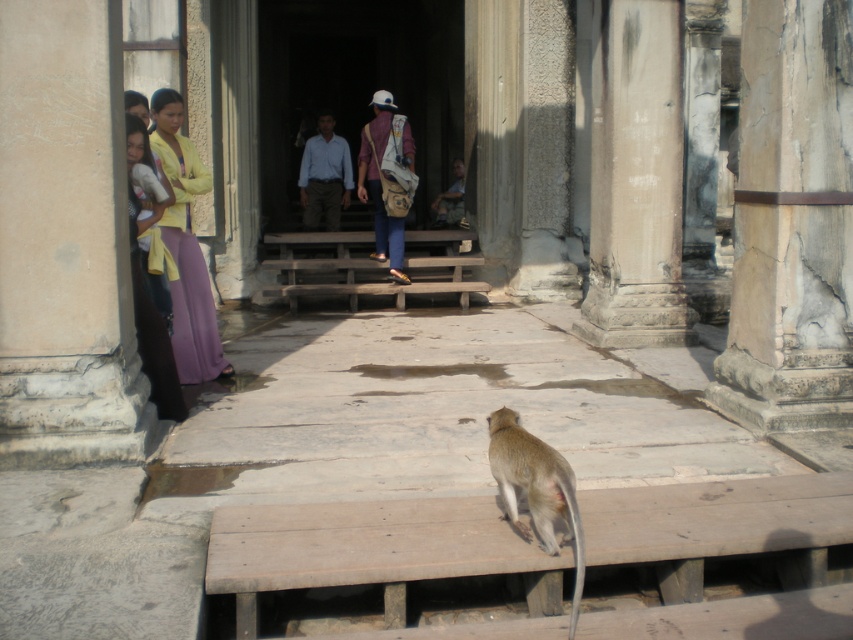
You are a tourist visiting the ancient temple and you see the purple silk pants at left and the matte yellow shirt at left. Which clothing item is higher in position?

The purple silk pants at left is taller than the matte yellow shirt at left, so the purple silk pants at left is higher in position.

Looking at this image, you are a tourist standing at the base of the temple steps. You see the white stone column at right and the purple silk pants at left. If you want to take a photo that includes both objects in the frame, how far apart should you position yourself from each object to ensure they are both visible?

To include both the white stone column at right and the purple silk pants at left in your photo, you should position yourself at least 4.03 meters away from each object. This distance ensures both are within the camera frame since they are 4.03 meters apart.

You are a tourist visiting the ancient temple and see the light brown fur monkey at lower center and the light blue shirt at center. Which object is shorter?

The light brown fur monkey at lower center is shorter than the light blue shirt at center.